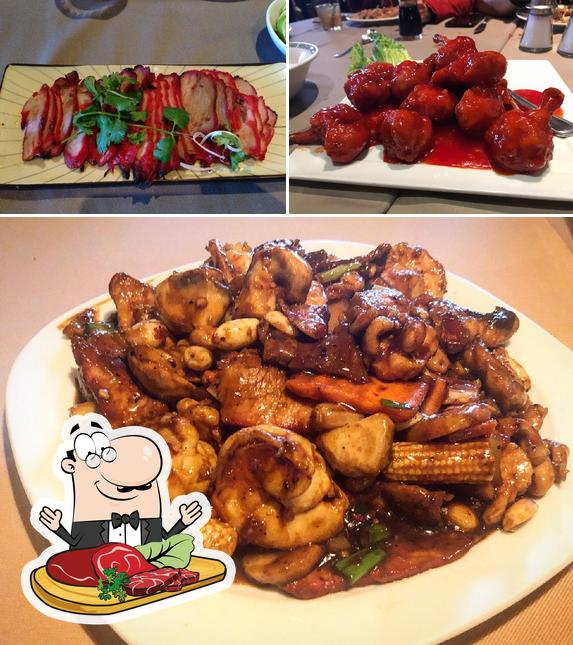
Find the location of `plate`. plate is located at coordinates [x=441, y=597].